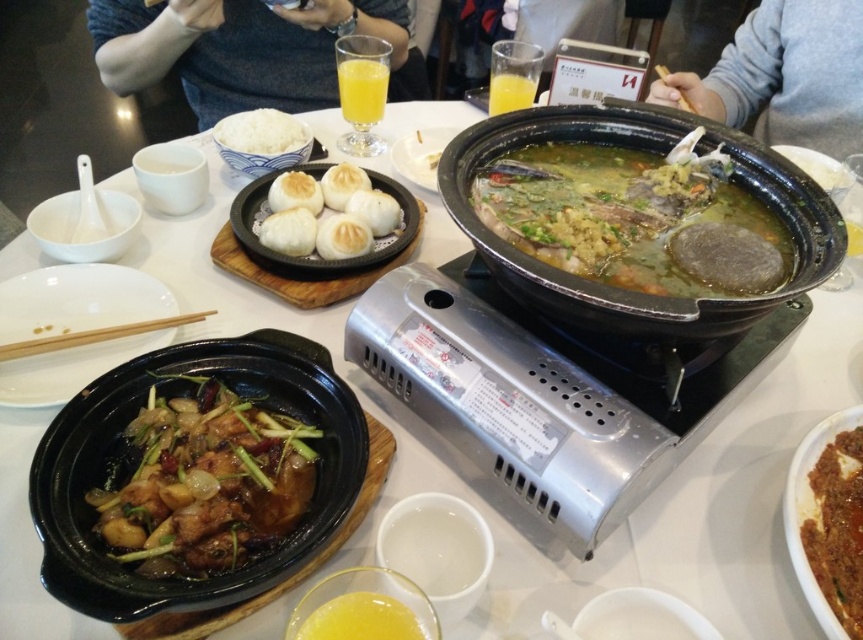
Who is higher up, gray fabric shirt at upper left or white glossy plate at lower left?

gray fabric shirt at upper left is higher up.

Does gray fabric shirt at upper left lie in front of white glossy plate at lower left?

No, it is not.

Does point (249, 52) come behind point (104, 264)?

Yes, point (249, 52) is behind point (104, 264).

In order to click on gray fabric shirt at upper left in this screenshot , I will do `click(237, 49)`.

Does tomato sauce tofu at center appear on the left side of matte black plate at center?

No, tomato sauce tofu at center is not to the left of matte black plate at center.

Based on the photo, does tomato sauce tofu at center lie in front of matte black plate at center?

Yes.

Between point (839, 608) and point (443, 134), which one is positioned behind?

The point (443, 134) is more distant.

This screenshot has width=863, height=640. I want to click on tomato sauce tofu at center, so pos(836,528).

Can you confirm if gray fabric shirt at upper left is positioned above wooden chopstick at upper center?

Yes.

Is point (300, 90) positioned behind point (681, 99)?

That is True.

The height and width of the screenshot is (640, 863). Identify the location of gray fabric shirt at upper left. (237, 49).